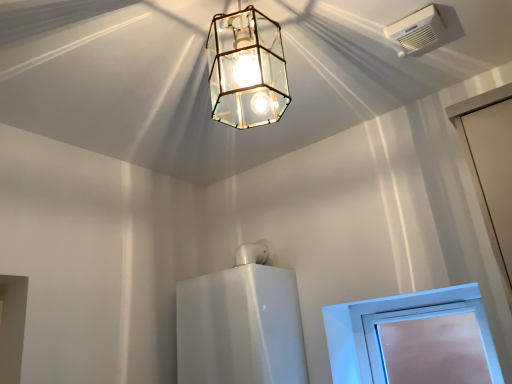
Locate an element on the screen. Image resolution: width=512 pixels, height=384 pixels. white glossy water heater at center is located at coordinates (240, 327).

Where is `clear glass lantern at upper center`? The height and width of the screenshot is (384, 512). clear glass lantern at upper center is located at coordinates (246, 69).

This screenshot has width=512, height=384. Identify the location of white glossy water heater at center. (240, 327).

Is white plastic window at lower right beside clear glass lantern at upper center?

No, white plastic window at lower right is not touching clear glass lantern at upper center.

From a real-world perspective, is white plastic window at lower right positioned over clear glass lantern at upper center based on gravity?

No, from a real-world perspective, white plastic window at lower right is not over clear glass lantern at upper center

Based on the photo, from the image's perspective, which is above, white plastic window at lower right or clear glass lantern at upper center?

From the image's view, clear glass lantern at upper center is above.

In terms of width, does white plastic window at lower right look wider or thinner when compared to clear glass lantern at upper center?

In the image, white plastic window at lower right appears to be more narrow than clear glass lantern at upper center.

From the image's perspective, is white plastic window at lower right under white plastic air conditioning unit at upper right?

Correct, white plastic window at lower right appears lower than white plastic air conditioning unit at upper right in the image.

From a real-world perspective, relative to white plastic air conditioning unit at upper right, is white plastic window at lower right vertically above or below?

Clearly, from a real-world perspective, white plastic window at lower right is below white plastic air conditioning unit at upper right.

Can you see white plastic window at lower right touching white plastic air conditioning unit at upper right?

No, white plastic window at lower right is not next to white plastic air conditioning unit at upper right.

Is point (476, 286) positioned after point (406, 39)?

Yes, it is behind point (406, 39).

Can you tell me how much white plastic air conditioning unit at upper right and white glossy water heater at center differ in facing direction?

1.26 degrees.

From a real-world perspective, which is physically above, white plastic air conditioning unit at upper right or white glossy water heater at center?

white plastic air conditioning unit at upper right, from a real-world perspective.

Looking at this image, does white plastic air conditioning unit at upper right come behind white glossy water heater at center?

No, white plastic air conditioning unit at upper right is closer to the camera.

Who is more distant, clear glass lantern at upper center or white plastic window at lower right?

white plastic window at lower right is further away from the camera.

From the image's perspective, which one is positioned higher, clear glass lantern at upper center or white plastic window at lower right?

clear glass lantern at upper center.

Are clear glass lantern at upper center and white plastic window at lower right located far from each other?

clear glass lantern at upper center is positioned a significant distance from white plastic window at lower right.

Are white plastic air conditioning unit at upper right and clear glass lantern at upper center making contact?

No, white plastic air conditioning unit at upper right is not next to clear glass lantern at upper center.

Can you tell me how much white plastic air conditioning unit at upper right and clear glass lantern at upper center differ in facing direction?

white plastic air conditioning unit at upper right and clear glass lantern at upper center are facing 6.69 degrees away from each other.

From a real-world perspective, who is located lower, white plastic air conditioning unit at upper right or clear glass lantern at upper center?

clear glass lantern at upper center.

Which of these two, white plastic air conditioning unit at upper right or clear glass lantern at upper center, is bigger?

clear glass lantern at upper center.

Is the position of white glossy water heater at center more distant than that of white plastic window at lower right?

No, it is in front of white plastic window at lower right.

From the image's perspective, which object appears higher, white glossy water heater at center or white plastic window at lower right?

white glossy water heater at center appears higher in the image.

Is clear glass lantern at upper center oriented towards white glossy water heater at center?

No, clear glass lantern at upper center does not turn towards white glossy water heater at center.

From a real-world perspective, between clear glass lantern at upper center and white glossy water heater at center, who is vertically higher?

clear glass lantern at upper center is physically above.

Does clear glass lantern at upper center have a lesser width compared to white glossy water heater at center?

Indeed, clear glass lantern at upper center has a lesser width compared to white glossy water heater at center.

You are a GUI agent. You are given a task and a screenshot of the screen. Output one action in this format:
    pyautogui.click(x=<x>, y=<y>)
    Task: Click on the window below the clear glass lantern at upper center (from the image's perspective)
    The image size is (512, 384).
    Given the screenshot: What is the action you would take?
    pyautogui.click(x=391, y=321)

Where is `air conditioning lying above the white plastic window at lower right (from the image's perspective)`? This screenshot has width=512, height=384. air conditioning lying above the white plastic window at lower right (from the image's perspective) is located at coordinates (416, 30).

From the image, which object appears to be nearer to clear glass lantern at upper center, white plastic window at lower right or white glossy water heater at center?

white glossy water heater at center is closer to clear glass lantern at upper center.

Which object lies nearer to the anchor point white plastic air conditioning unit at upper right, white glossy water heater at center or white plastic window at lower right?

white plastic window at lower right is closer to white plastic air conditioning unit at upper right.

Estimate the real-world distances between objects in this image. Which object is further from white glossy water heater at center, white plastic air conditioning unit at upper right or clear glass lantern at upper center?

Based on the image, white plastic air conditioning unit at upper right appears to be further to white glossy water heater at center.

From the image, which object appears to be nearer to white plastic air conditioning unit at upper right, clear glass lantern at upper center or white glossy water heater at center?

clear glass lantern at upper center lies closer to white plastic air conditioning unit at upper right than the other object.

When comparing their distances from white plastic air conditioning unit at upper right, does clear glass lantern at upper center or white plastic window at lower right seem further?

Based on the image, white plastic window at lower right appears to be further to white plastic air conditioning unit at upper right.

Considering their positions, is white glossy water heater at center positioned closer to white plastic window at lower right than clear glass lantern at upper center?

white glossy water heater at center.

Looking at the image, which one is located further to white glossy water heater at center, clear glass lantern at upper center or white plastic window at lower right?

Based on the image, clear glass lantern at upper center appears to be further to white glossy water heater at center.

Based on their spatial positions, is clear glass lantern at upper center or white plastic air conditioning unit at upper right further from white glossy water heater at center?

white plastic air conditioning unit at upper right.

This screenshot has width=512, height=384. Find the location of `lamp between white plastic air conditioning unit at upper right and white plastic window at lower right in the up-down direction`. lamp between white plastic air conditioning unit at upper right and white plastic window at lower right in the up-down direction is located at coordinates (246, 69).

Where is `appliance that lies between clear glass lantern at upper center and white plastic window at lower right from top to bottom`? appliance that lies between clear glass lantern at upper center and white plastic window at lower right from top to bottom is located at coordinates (240, 327).

Locate an element on the screen. Image resolution: width=512 pixels, height=384 pixels. lamp between white plastic air conditioning unit at upper right and white glossy water heater at center in the up-down direction is located at coordinates (246, 69).

Find the location of a particular element. appliance between white plastic air conditioning unit at upper right and white plastic window at lower right in the vertical direction is located at coordinates (240, 327).